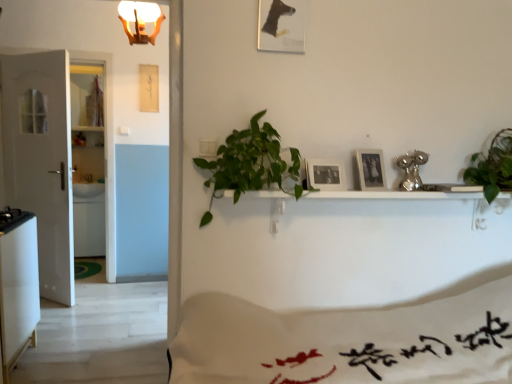
Locate an element on the screen. The height and width of the screenshot is (384, 512). free location to the right of white glossy refrigerator at lower left is located at coordinates (71, 362).